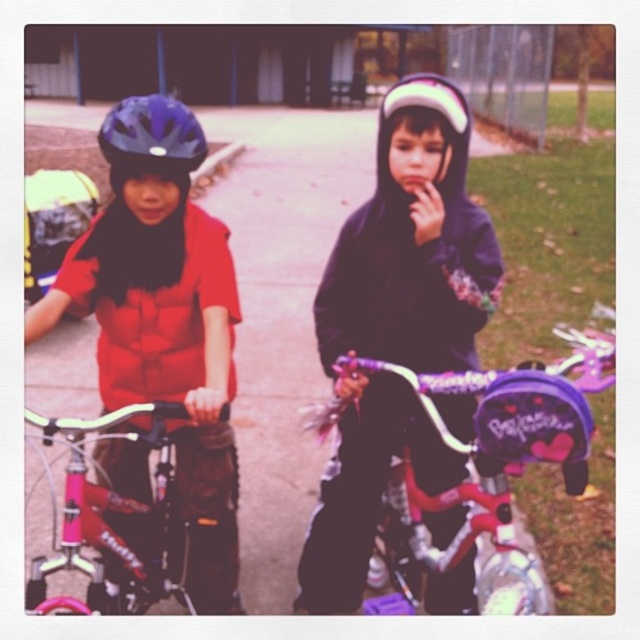
Which is below, matte black helmet at upper left or white matte helmet at center?

white matte helmet at center is lower down.

Is point (136, 154) closer to viewer compared to point (435, 76)?

Yes, it is.

At what (x,y) coordinates should I click in order to perform the action: click on matte black helmet at upper left. Please return your answer as a coordinate pair (x, y). Looking at the image, I should click on (152, 134).

Between matte black hoodie at center and matte black helmet at left, which one appears on the left side from the viewer's perspective?

Positioned to the left is matte black helmet at left.

Is point (349, 260) positioned after point (220, 499)?

No, (349, 260) is closer to viewer.

Locate an element on the screen. matte black hoodie at center is located at coordinates (396, 324).

Between matte black helmet at left and shiny pink bicycle at center, which one appears on the left side from the viewer's perspective?

matte black helmet at left

Find the location of a particular element. The height and width of the screenshot is (640, 640). matte black helmet at left is located at coordinates (163, 320).